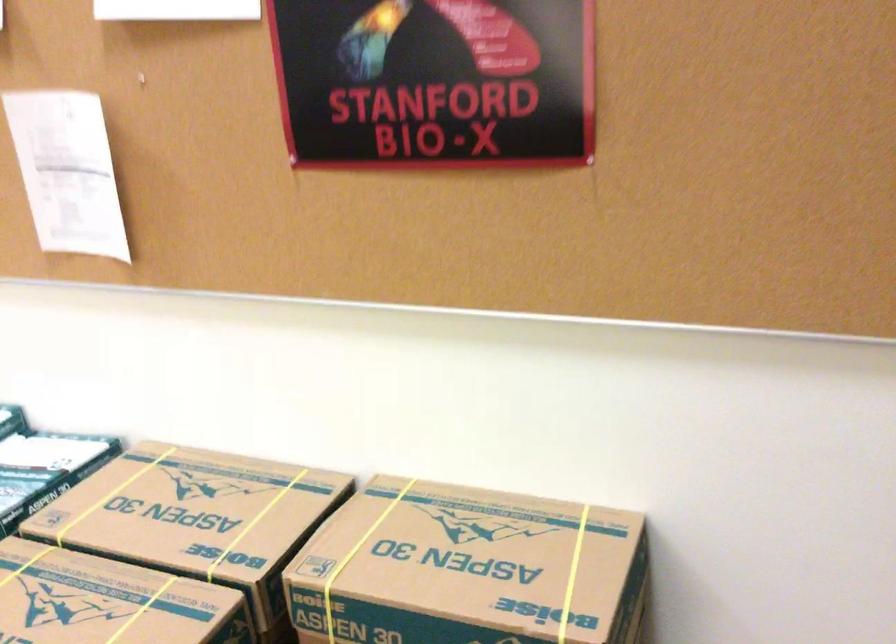
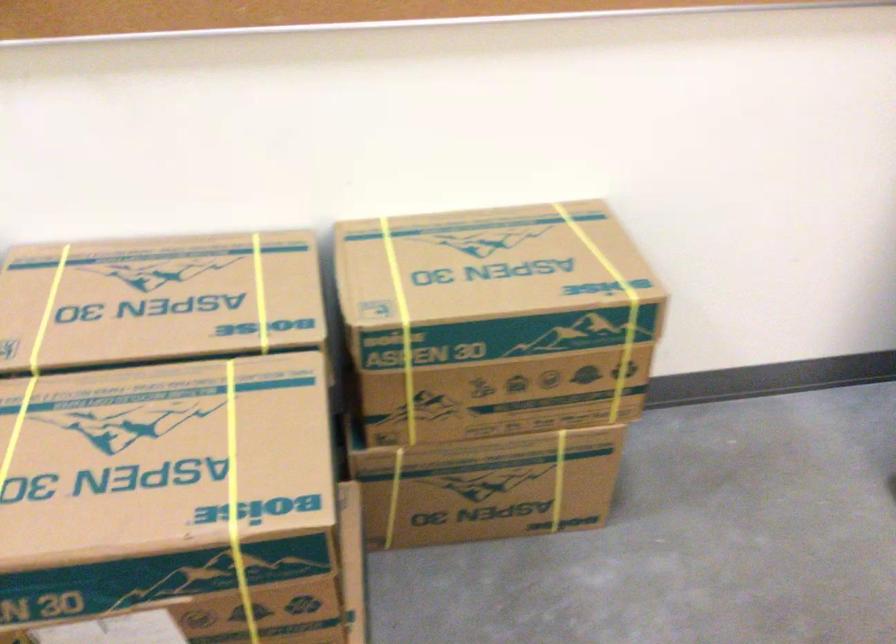
Where in the second image is the point corresponding to (x=105, y=494) from the first image?

(47, 310)